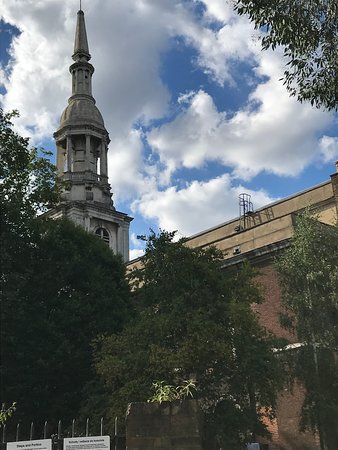
Identify the location of columns. (86, 159), (67, 148), (104, 160).